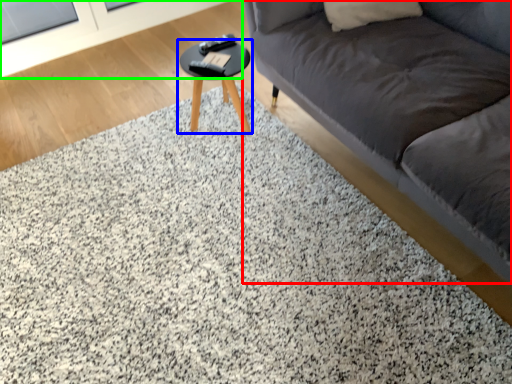
Question: Based on their relative distances, which object is nearer to studio couch (highlighted by a red box)? Choose from table (highlighted by a blue box) and screen door (highlighted by a green box).

Choices:
 (A) table
 (B) screen door

Answer: (A)